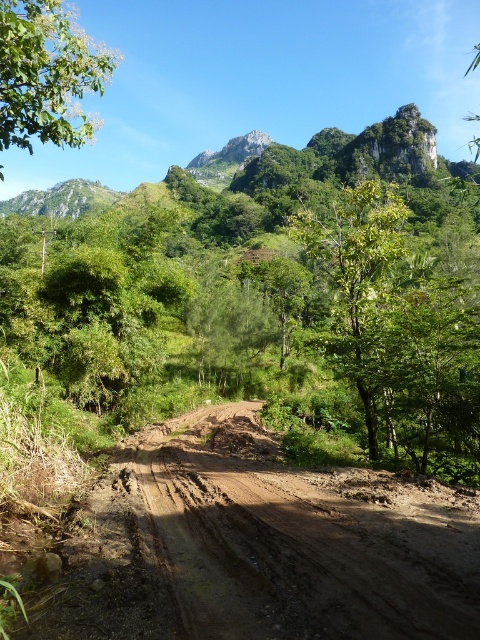
You are standing at the origin point of the image and want to walk to the green leafy tree at center. What are the coordinates of the direction you should walk towards?

The coordinates of the green leafy tree at center are at point (359, 282), so you should walk towards the coordinates (359, 282) to reach it.